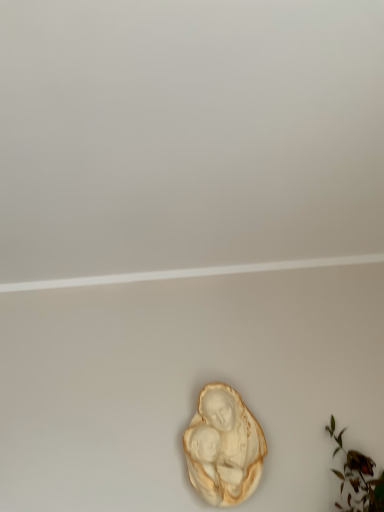
This screenshot has width=384, height=512. What do you see at coordinates (224, 447) in the screenshot?
I see `matte cream sculpture at center` at bounding box center [224, 447].

Identify the location of matte cream sculpture at center. The image size is (384, 512). (224, 447).

Identify the location of matte cream sculpture at center. (224, 447).